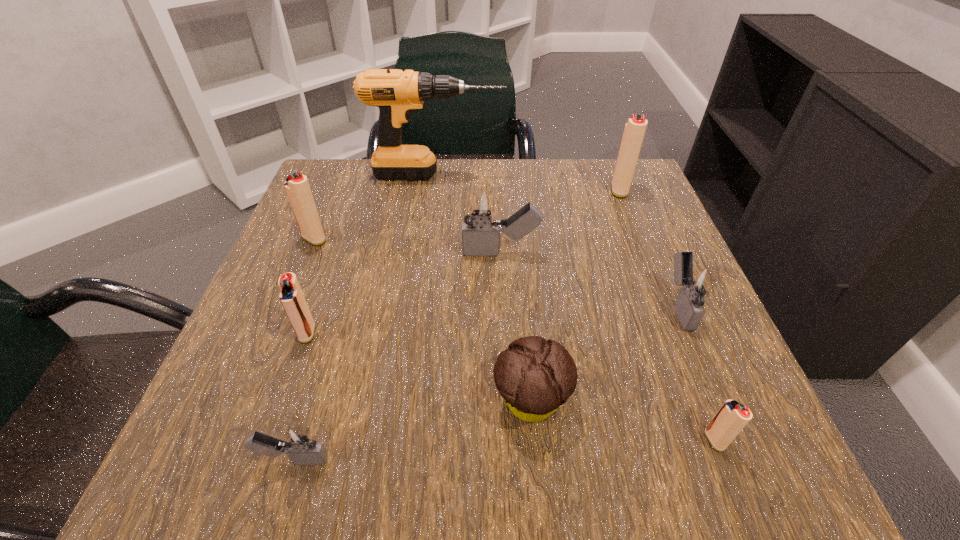
Locate which igniter is the second closest to the rightmost gray igniter. Please provide its 2D coordinates. Your answer should be formatted as a tuple, i.e. [(x, y)], where the tuple contains the x and y coordinates of a point satisfying the conditions above.

[(479, 206)]

Image resolution: width=960 pixels, height=540 pixels. Find the location of `the third closest igniter to the nearest gray igniter`. the third closest igniter to the nearest gray igniter is located at coordinates (297, 187).

Identify which red igniter is located as the nearest to the third smallest red igniter. Please provide its 2D coordinates. Your answer should be formatted as a tuple, i.e. [(x, y)], where the tuple contains the x and y coordinates of a point satisfying the conditions above.

[(291, 296)]

Locate an element on the screen. This screenshot has width=960, height=540. red igniter object that ranks as the third closest to the tallest igniter is located at coordinates (291, 296).

Locate an element on the screen. This screenshot has height=540, width=960. gray igniter that is the second nearest to the chocolate muffin is located at coordinates (297, 441).

Where is `gray igniter that stands as the closest to the farthest igniter`? This screenshot has height=540, width=960. gray igniter that stands as the closest to the farthest igniter is located at coordinates 479,206.

This screenshot has width=960, height=540. I want to click on free space that satisfies the following two spatial constraints: 1. at the tip of the drill; 2. on the right side of the rightmost gray igniter, so click(420, 306).

Image resolution: width=960 pixels, height=540 pixels. I want to click on vacant space that satisfies the following two spatial constraints: 1. on the back side of the rightmost gray igniter; 2. on the left side of the smallest red igniter, so click(x=662, y=306).

What are the coordinates of `blank space that satisfies the following two spatial constraints: 1. at the tip of the chocolate muffin; 2. on the left side of the drill` in the screenshot? It's located at (408, 402).

Find the location of a particular element. The width and height of the screenshot is (960, 540). blank area in the image that satisfies the following two spatial constraints: 1. on the back side of the nearest red igniter; 2. on the left side of the nearest gray igniter is located at coordinates (300, 440).